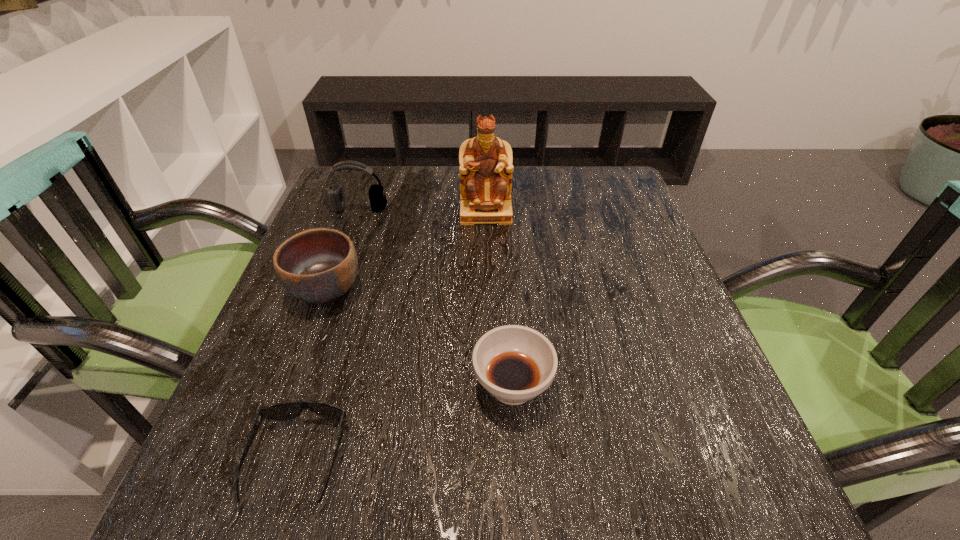
Locate an element on the screen. This screenshot has width=960, height=540. the tallest object is located at coordinates (485, 161).

Identify the location of headset. (335, 200).

I want to click on the third farthest object, so click(x=317, y=266).

I want to click on bowl, so click(317, 266).

Where is `the fourth tallest object`? the fourth tallest object is located at coordinates (514, 363).

In order to click on sunglasses in this screenshot , I will do `click(281, 411)`.

Find the location of a particular element. The width and height of the screenshot is (960, 540). free space located 0.220m on the front-facing side of the tallest object is located at coordinates (487, 291).

Where is `free region located on the headband of the second tallest object`? This screenshot has width=960, height=540. free region located on the headband of the second tallest object is located at coordinates (323, 310).

Find the location of a particular element. This screenshot has height=540, width=960. free space located on the front of the bowl is located at coordinates click(275, 431).

You are a GUI agent. You are given a task and a screenshot of the screen. Output one action in this format:
    pyautogui.click(x=<x>, y=<y>)
    Task: Click on the free region located 0.120m on the front of the second shortest object
    The height and width of the screenshot is (540, 960).
    Given the screenshot: What is the action you would take?
    pyautogui.click(x=520, y=507)